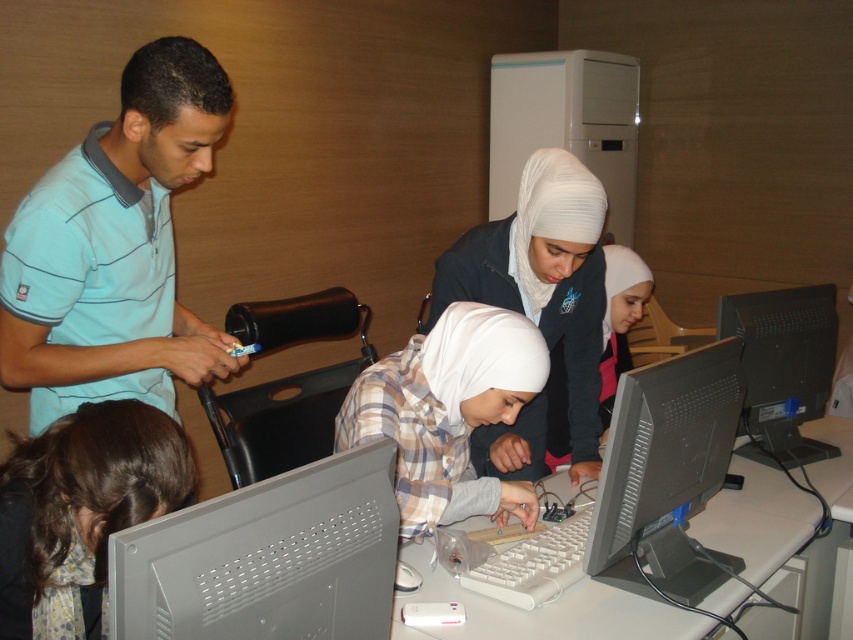
You are standing in the room and notice a person with dark brown hair at lower left. Where exactly is this person positioned in relation to the wooden wall in the background?

The dark brown hair at lower left is located at point (80, 497), which means it is positioned closer to the left side and lower portion of the image, near the wooden wall in the background.

You are standing in the room and want to move towards the two points in the image. Which point, point (x=129, y=545) or point (x=575, y=280), would you reach first?

You would reach point (x=129, y=545) first because it is closer to you than point (x=575, y=280).